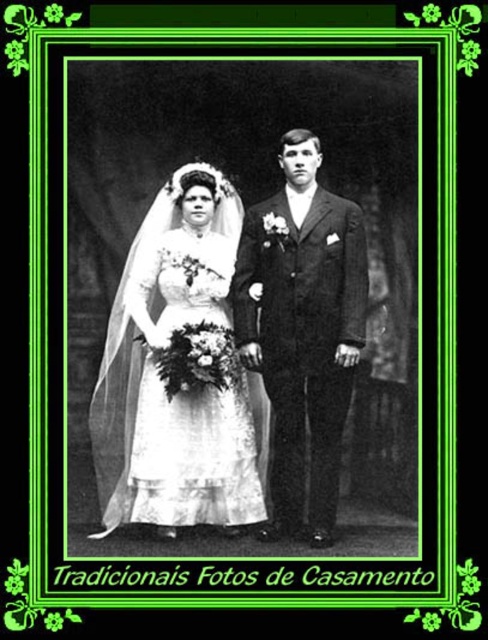
Is white satin dress at center taller than smooth black suit at center?

No, white satin dress at center is not taller than smooth black suit at center.

From the picture: Between white satin dress at center and smooth black suit at center, which one is positioned lower?

white satin dress at center

The image size is (488, 640). Describe the element at coordinates (162, 384) in the screenshot. I see `white satin dress at center` at that location.

You are a GUI agent. You are given a task and a screenshot of the screen. Output one action in this format:
    pyautogui.click(x=<x>, y=<y>)
    Task: Click on the white satin dress at center
    The image size is (488, 640).
    Given the screenshot: What is the action you would take?
    pyautogui.click(x=162, y=384)